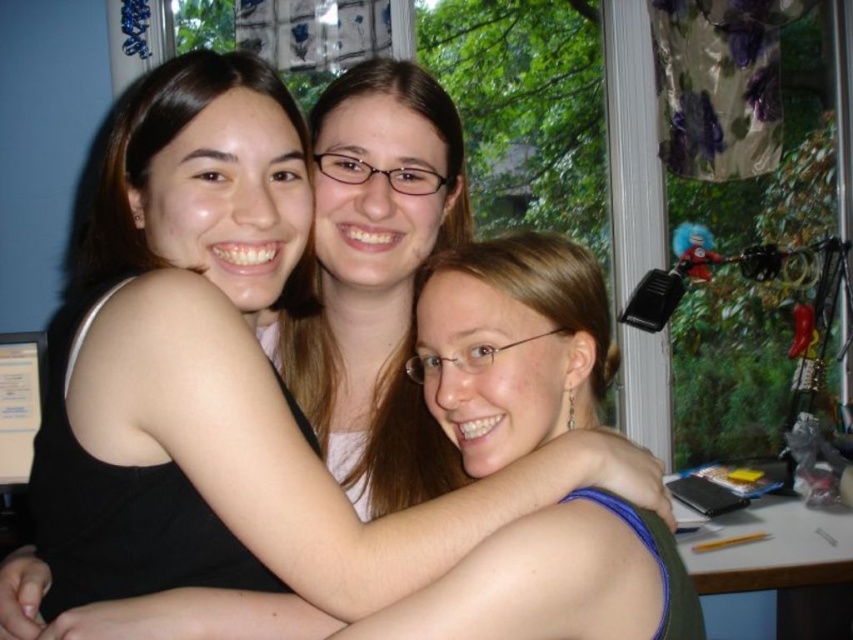
Question: Which of the following is the farthest from the observer?

Choices:
 (A) (473, 531)
 (B) (772, 536)

Answer: (B)

Question: Does black matte tank top at left have a smaller size compared to wooden desk at lower right?

Choices:
 (A) yes
 (B) no

Answer: (B)

Question: Can you confirm if black matte tank top at left is thinner than wooden desk at lower right?

Choices:
 (A) yes
 (B) no

Answer: (B)

Question: Observing the image, what is the correct spatial positioning of black matte tank top at left in reference to wooden desk at lower right?

Choices:
 (A) right
 (B) left

Answer: (B)

Question: Which of the following is the closest to the observer?

Choices:
 (A) (213, 304)
 (B) (811, 531)

Answer: (A)